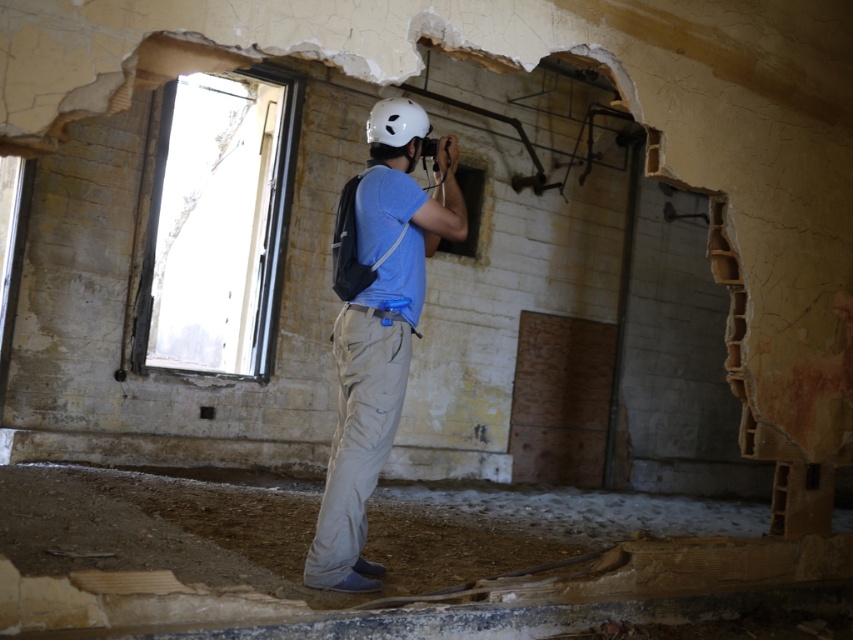
Question: Among these objects, which one is nearest to the camera?

Choices:
 (A) matte blue shirt at center
 (B) smooth concrete hole at center
 (C) white matte helmet at center

Answer: (A)

Question: Is white matte helmet at center positioned before smooth concrete hole at center?

Choices:
 (A) no
 (B) yes

Answer: (B)

Question: Which point is closer to the camera?

Choices:
 (A) smooth concrete hole at center
 (B) white matte helmet at center

Answer: (B)

Question: Does matte blue shirt at center have a lesser width compared to white matte helmet at center?

Choices:
 (A) yes
 (B) no

Answer: (B)

Question: Which object is farther from the camera taking this photo?

Choices:
 (A) matte blue shirt at center
 (B) white matte helmet at center
 (C) smooth concrete hole at center

Answer: (C)

Question: Is matte blue shirt at center above smooth concrete hole at center?

Choices:
 (A) no
 (B) yes

Answer: (A)